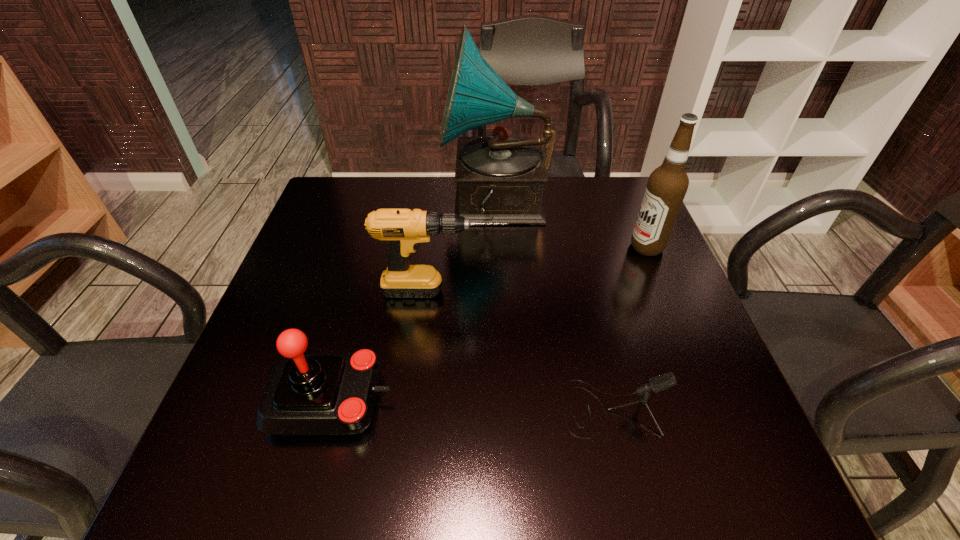
I want to click on object that is at the left edge, so click(306, 394).

Image resolution: width=960 pixels, height=540 pixels. I want to click on alcohol at the right edge, so click(x=667, y=185).

Where is `microphone at the right edge`? The image size is (960, 540). microphone at the right edge is located at coordinates tap(659, 383).

I want to click on vacant region at the far edge, so click(566, 180).

This screenshot has height=540, width=960. I want to click on free space at the near edge of the desktop, so click(359, 462).

Image resolution: width=960 pixels, height=540 pixels. I want to click on vacant region at the left edge of the desktop, so click(311, 234).

In the image, there is a desktop. Where is `vacant space at the right edge`? The width and height of the screenshot is (960, 540). vacant space at the right edge is located at coordinates (731, 436).

Where is `free spot at the far left corner of the desktop`? free spot at the far left corner of the desktop is located at coordinates tap(368, 197).

Locate an element on the screen. Image resolution: width=960 pixels, height=540 pixels. vacant space at the near left corner of the desktop is located at coordinates (283, 450).

This screenshot has width=960, height=540. What are the coordinates of `vacant position at the far right corner of the desktop` in the screenshot? It's located at (585, 185).